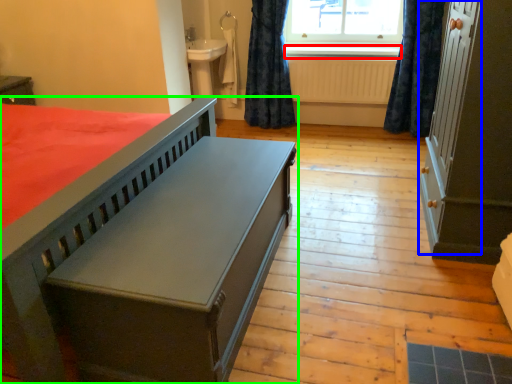
Question: Which is nearer to the window sill (highlighted by a red box)? screen door (highlighted by a blue box) or bed (highlighted by a green box).

Choices:
 (A) screen door
 (B) bed

Answer: (A)